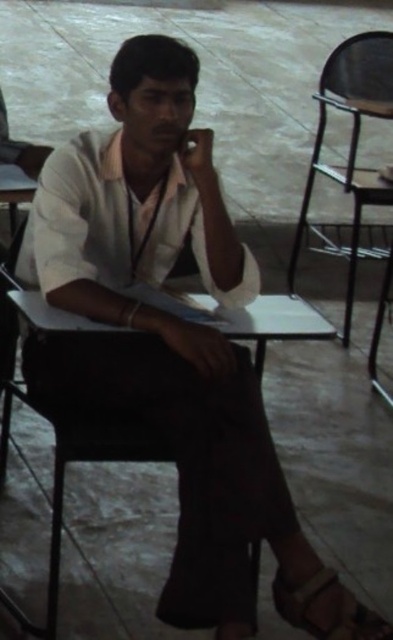
Question: Is metallic black chair at right wider than brown leather sandal at lower right?

Choices:
 (A) yes
 (B) no

Answer: (A)

Question: Observing the image, what is the correct spatial positioning of metallic black chair at right in reference to brown leather sandal at lower right?

Choices:
 (A) right
 (B) left

Answer: (A)

Question: Among these objects, which one is nearest to the camera?

Choices:
 (A) metallic black chair at right
 (B) brown leather sandal at lower right

Answer: (B)

Question: Can you confirm if metallic black chair at right is positioned to the left of brown leather sandal at lower right?

Choices:
 (A) yes
 (B) no

Answer: (B)

Question: Which point is farther from the camera taking this photo?

Choices:
 (A) (356, 61)
 (B) (332, 592)

Answer: (A)